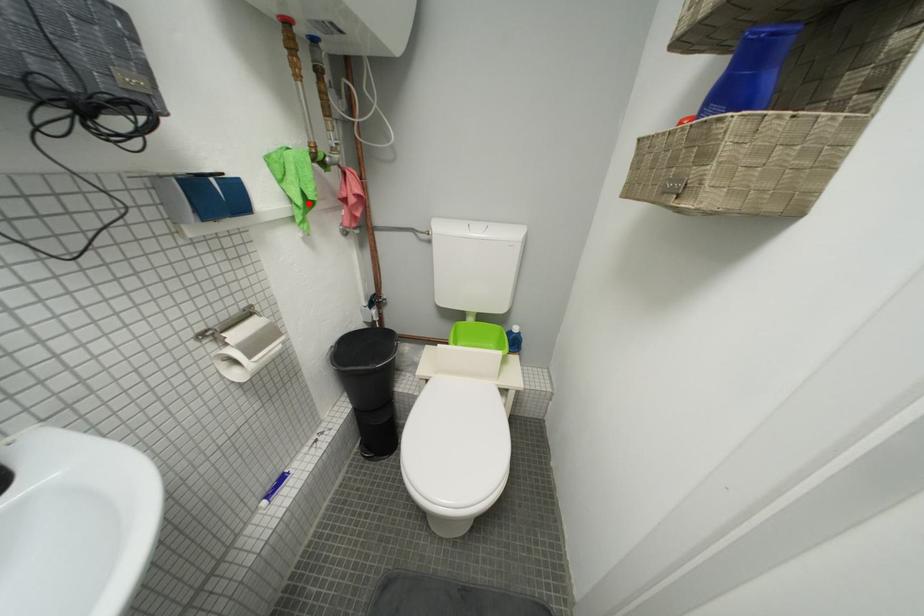
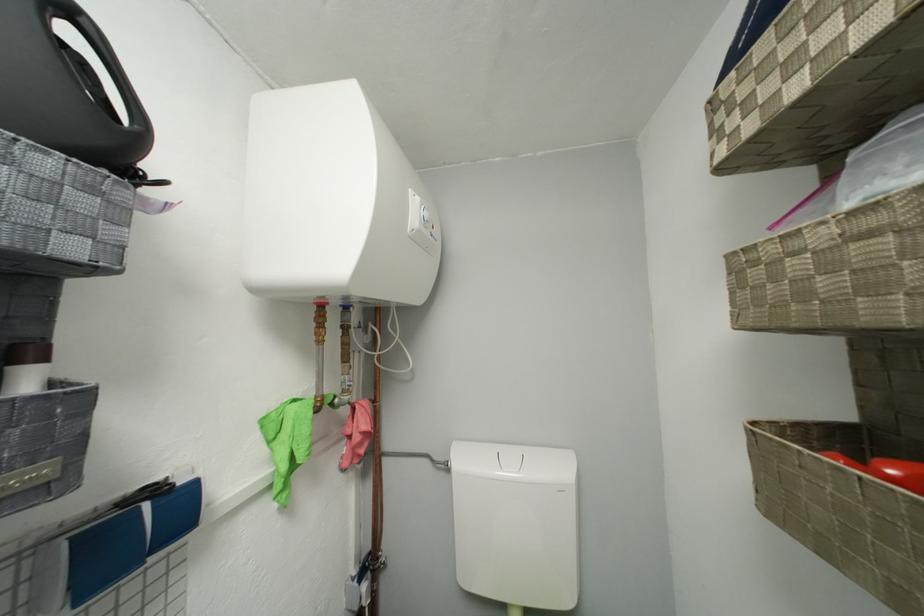
Where in the second image is the point corresponding to the highlighted location from the first image?

(293, 469)